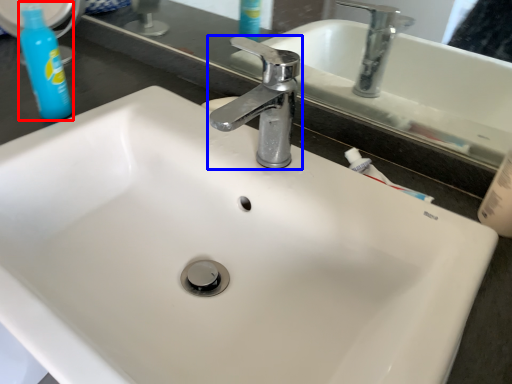
Question: Which of the following is the closest to the observer, cleaning product (highlighted by a red box) or tap (highlighted by a blue box)?

Choices:
 (A) cleaning product
 (B) tap

Answer: (B)